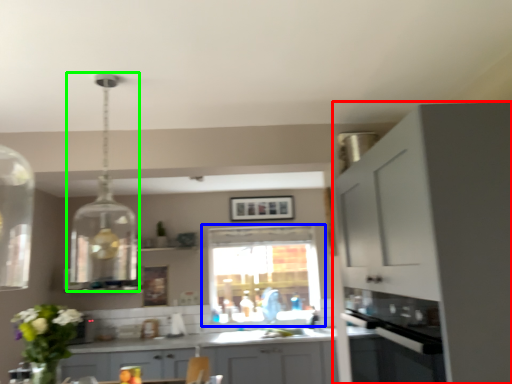
Question: Which object is the farthest from cabinetry (highlighted by a red box)? Choose among these: window (highlighted by a blue box) or light fixture (highlighted by a green box).

Choices:
 (A) window
 (B) light fixture

Answer: (A)